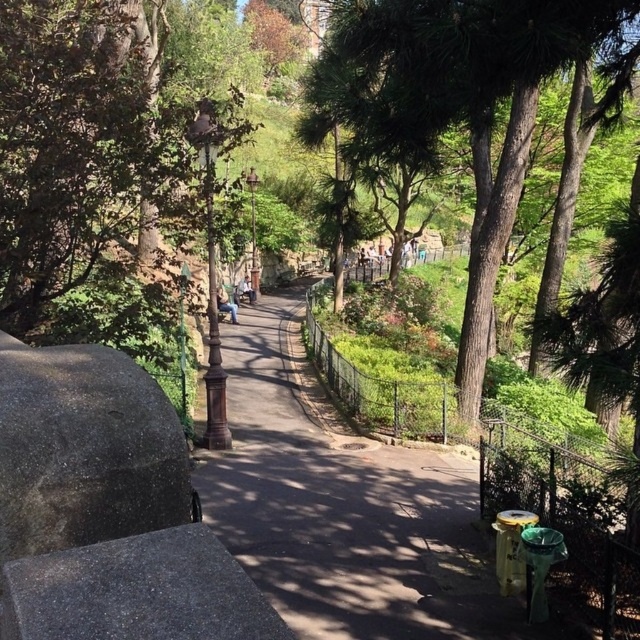
Looking at this image, you are a photographer standing at the center of the park pathway. You want to take a photo of the green leafy tree at upper left and the light blue jeans at center. Which object will appear larger in the photo?

The green leafy tree at upper left will appear larger in the photo because it is taller than the light blue jeans at center.

You are a person standing on the park pathway and see the denim jacket at center and light blue jeans at center. Which item is positioned lower relative to the other?

The denim jacket at center is positioned below the light blue jeans at center, so it is lower.